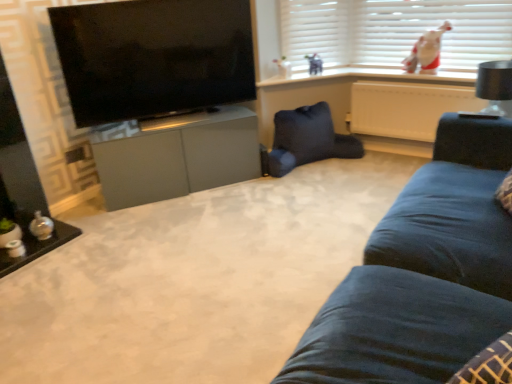
Question: From the image's perspective, is black glossy tv at upper left located beneath dark blue fabric swivel chair at center?

Choices:
 (A) no
 (B) yes

Answer: (A)

Question: Can you confirm if black glossy tv at upper left is wider than dark blue fabric swivel chair at center?

Choices:
 (A) no
 (B) yes

Answer: (A)

Question: Is black glossy tv at upper left turned away from dark blue fabric swivel chair at center?

Choices:
 (A) yes
 (B) no

Answer: (B)

Question: Is black glossy tv at upper left bigger than dark blue fabric swivel chair at center?

Choices:
 (A) no
 (B) yes

Answer: (B)

Question: From a real-world perspective, is black glossy tv at upper left located higher than dark blue fabric swivel chair at center?

Choices:
 (A) yes
 (B) no

Answer: (A)

Question: Based on their positions, is black matte lampshade at upper right located to the left or right of black glossy tv at upper left?

Choices:
 (A) left
 (B) right

Answer: (B)

Question: In terms of size, does black matte lampshade at upper right appear bigger or smaller than black glossy tv at upper left?

Choices:
 (A) small
 (B) big

Answer: (A)

Question: From the image's perspective, is black matte lampshade at upper right above or below black glossy tv at upper left?

Choices:
 (A) above
 (B) below

Answer: (B)

Question: Looking at their shapes, would you say black matte lampshade at upper right is wider or thinner than black glossy tv at upper left?

Choices:
 (A) thin
 (B) wide

Answer: (B)

Question: Considering the positions of point (446, 23) and point (400, 122), is point (446, 23) closer or farther from the camera than point (400, 122)?

Choices:
 (A) closer
 (B) farther

Answer: (A)

Question: From a real-world perspective, is white plush toy at upper right positioned above or below white plastic radiator at upper right?

Choices:
 (A) below
 (B) above

Answer: (B)

Question: Is white plush toy at upper right inside the boundaries of white plastic radiator at upper right, or outside?

Choices:
 (A) outside
 (B) inside

Answer: (A)

Question: Is white plush toy at upper right in front of or behind white plastic radiator at upper right in the image?

Choices:
 (A) behind
 (B) front

Answer: (A)

Question: Considering the positions of white plastic radiator at upper right and black glossy tv at upper left in the image, is white plastic radiator at upper right bigger or smaller than black glossy tv at upper left?

Choices:
 (A) big
 (B) small

Answer: (B)

Question: Considering the positions of point (369, 107) and point (240, 87), is point (369, 107) closer or farther from the camera than point (240, 87)?

Choices:
 (A) farther
 (B) closer

Answer: (A)